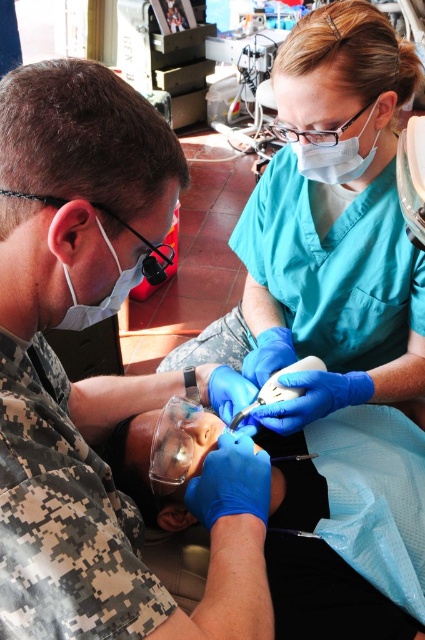
You are a medical assistant in the field and need to access the blue rubber gloves at lower center. Based on their coordinates, which object are they positioned closest to?

The blue rubber gloves at lower center are located at point (98, 376), which places them closest to the teal scrubs wearer holding the dental tool.

You are a medical student observing a dental procedure in a field setting. You notice the blue rubber gloves at lower center and the teal fabric scrubs at center. Which item is positioned closer to you?

The blue rubber gloves at lower center are closer to the viewer than the teal fabric scrubs at center.

You are a medical supply manager checking the inventory. You need to determine which item is more suitable for a procedure requiring flexibility. Based on the image, which object is thinner between the blue rubber gloves at lower center and the teal fabric scrubs at center?

The blue rubber gloves at lower center is thinner than the teal fabric scrubs at center, so it is more suitable for procedures requiring flexibility.